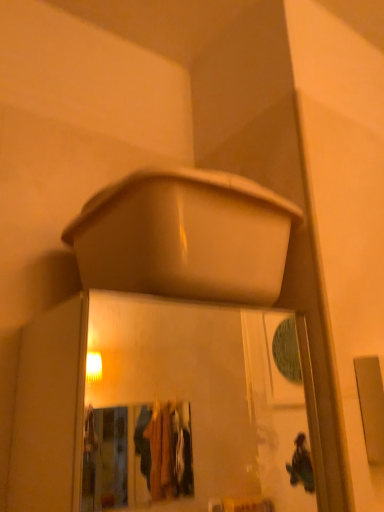
What do you see at coordinates (185, 237) in the screenshot?
I see `matte beige urinal at upper center` at bounding box center [185, 237].

Measure the distance between matte beige urinal at upper center and camera.

matte beige urinal at upper center is 23.52 inches away from camera.

I want to click on matte beige urinal at upper center, so click(x=185, y=237).

Find the location of `matte beige urinal at upper center`. matte beige urinal at upper center is located at coordinates (185, 237).